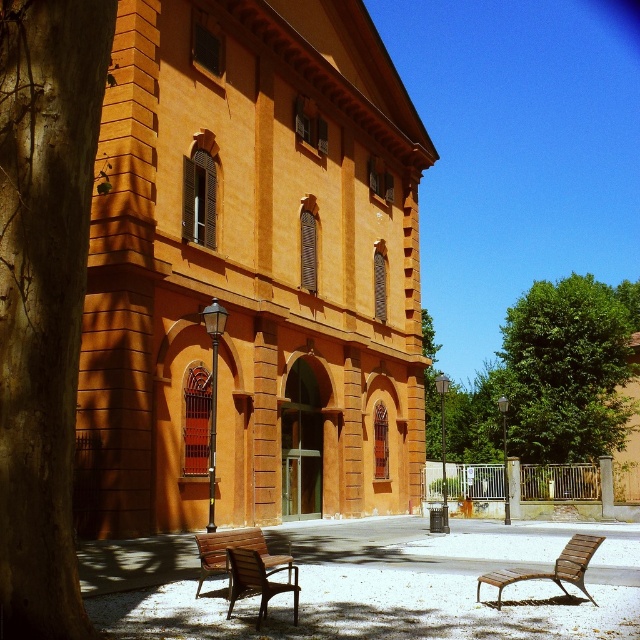
Is smooth brown tree trunk at left positioned at the back of wooden park bench at lower left?

No, it is not.

What are the coordinates of `smooth brown tree trunk at left` in the screenshot? It's located at (44, 296).

Which is behind, point (561, 492) or point (243, 566)?

The point (561, 492) is behind.

Is point (548, 449) closer to viewer compared to point (236, 580)?

No, (548, 449) is further to viewer.

The height and width of the screenshot is (640, 640). Identify the location of green leafy tree at center. (568, 369).

Is wooden park bench at lower left smaller than brown wooden chair at lower center?

Incorrect, wooden park bench at lower left is not smaller in size than brown wooden chair at lower center.

What do you see at coordinates (234, 547) in the screenshot? Image resolution: width=640 pixels, height=640 pixels. I see `wooden park bench at lower left` at bounding box center [234, 547].

Locate an element on the screen. This screenshot has height=640, width=640. wooden park bench at lower left is located at coordinates (234, 547).